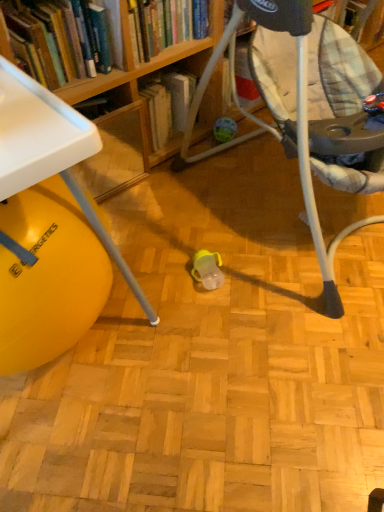
Where is `vacant space that is in between white plastic table at lower left and matte plastic baby swing at center`? The width and height of the screenshot is (384, 512). vacant space that is in between white plastic table at lower left and matte plastic baby swing at center is located at coordinates (190, 271).